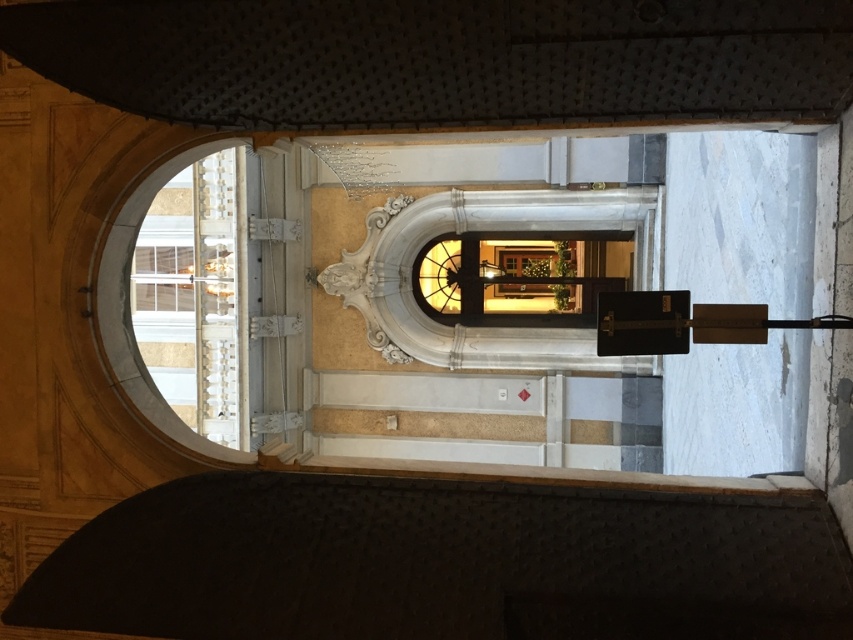
Is matte glass door at center positioned in front of white marble window at upper left?

No, matte glass door at center is further to the viewer.

Can you confirm if matte glass door at center is positioned below white marble window at upper left?

Actually, matte glass door at center is above white marble window at upper left.

The width and height of the screenshot is (853, 640). I want to click on matte glass door at center, so click(x=512, y=278).